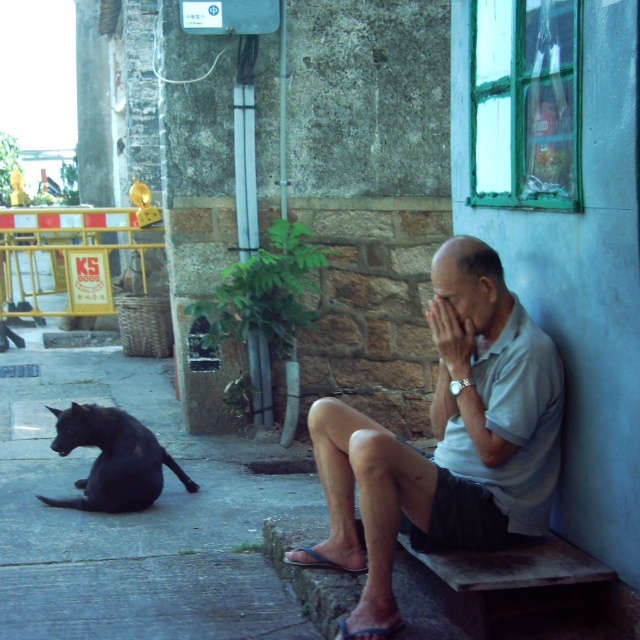
Question: Which point is closer to the camera?

Choices:
 (A) black smooth pavement at lower left
 (B) light gray cotton shirt at center

Answer: (B)

Question: Is light gray cotton shirt at center below shiny black cat at lower left?

Choices:
 (A) no
 (B) yes

Answer: (A)

Question: Which point appears farthest from the camera in this image?

Choices:
 (A) (364, 525)
 (B) (33, 356)

Answer: (B)

Question: Among these points, which one is farthest from the camera?

Choices:
 (A) (99, 413)
 (B) (524, 396)
 (C) (49, 582)

Answer: (A)

Question: Can you confirm if light gray cotton shirt at center is positioned to the right of shiny black cat at lower left?

Choices:
 (A) yes
 (B) no

Answer: (A)

Question: Is black smooth pavement at lower left bigger than light gray cotton shirt at center?

Choices:
 (A) no
 (B) yes

Answer: (A)